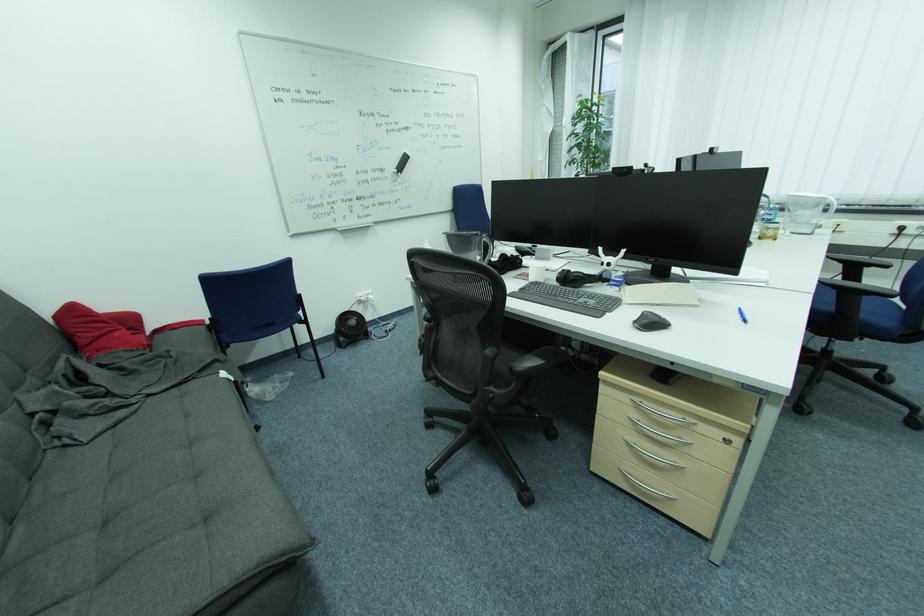
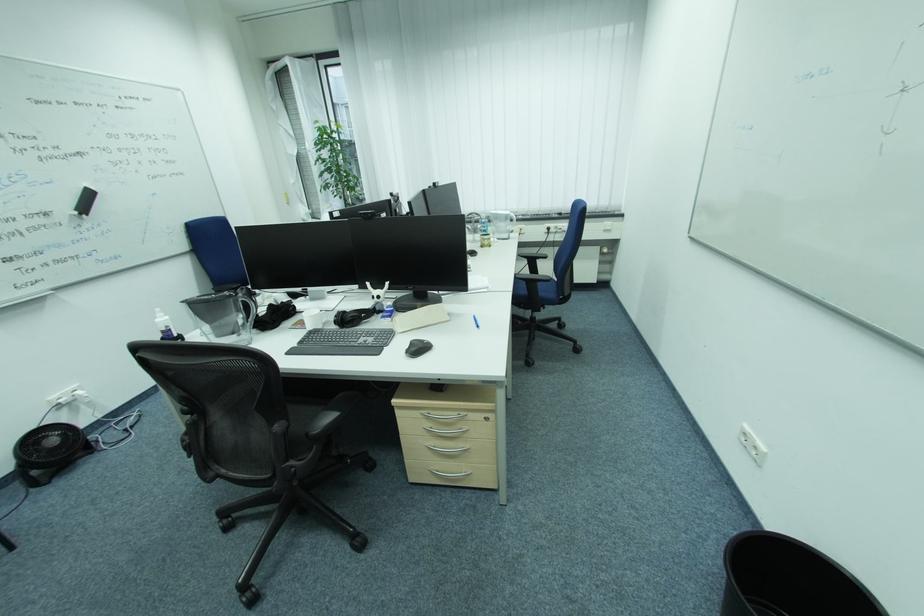
Locate, in the second image, the point that corresponds to the point at 646,422 in the first image.

(438, 429)